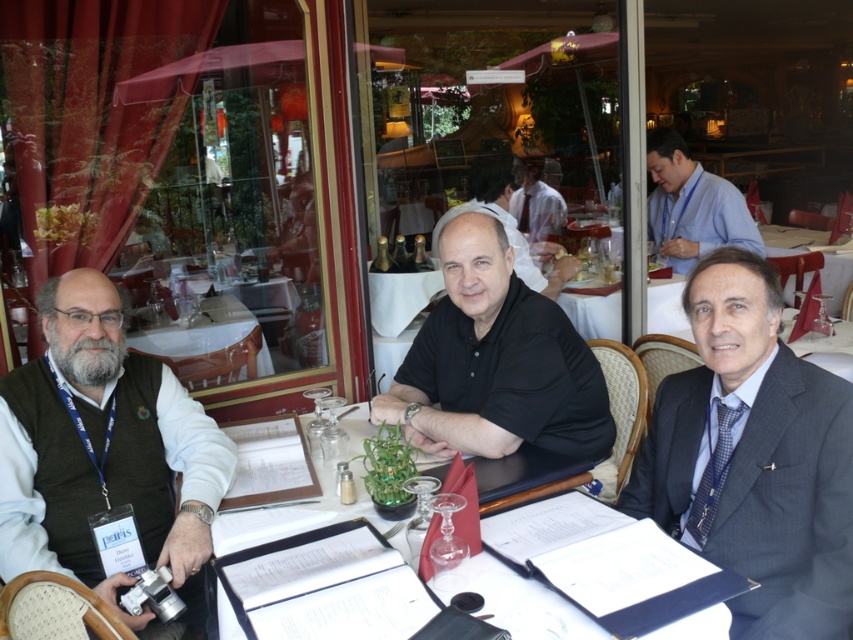
Question: Considering the relative positions of dark green vest at left and black shirt at center in the image provided, where is dark green vest at left located with respect to black shirt at center?

Choices:
 (A) right
 (B) left

Answer: (B)

Question: Does black smooth shirt at center appear under black shirt at center?

Choices:
 (A) yes
 (B) no

Answer: (A)

Question: Is dark green vest at left to the right of black shirt at center from the viewer's perspective?

Choices:
 (A) yes
 (B) no

Answer: (B)

Question: Estimate the real-world distances between objects in this image. Which object is closer to the dark gray suit at right?

Choices:
 (A) white paper at center
 (B) black smooth shirt at center

Answer: (A)

Question: Which point is closer to the camera?

Choices:
 (A) blue shirt at upper right
 (B) dark green vest at left
 (C) white paper at center
 (D) black shirt at center

Answer: (C)

Question: Which point is closer to the camera taking this photo?

Choices:
 (A) (524, 273)
 (B) (532, 620)

Answer: (B)